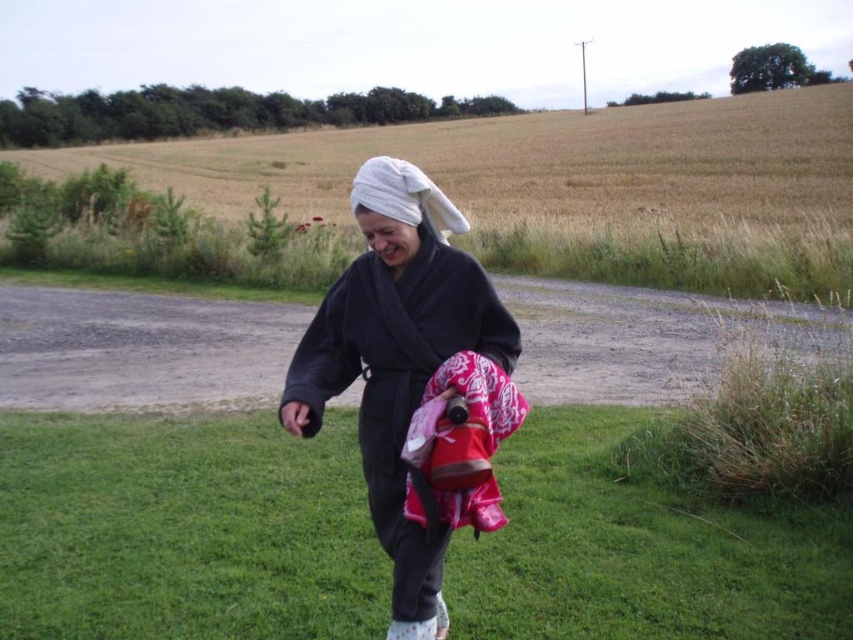
Who is more distant from viewer, (223, 552) or (397, 157)?

Positioned behind is point (397, 157).

Does green grass at lower center lie behind white towel at center?

Yes, it is.

Identify the location of green grass at lower center. This screenshot has width=853, height=640. (184, 531).

Does green grass at lower center have a larger size compared to brown grassland at center?

No.

Who is lower down, green grass at lower center or brown grassland at center?

green grass at lower center

Describe the element at coordinates (184, 531) in the screenshot. I see `green grass at lower center` at that location.

Locate an element on the screen. green grass at lower center is located at coordinates (184, 531).

Which of these two, brown grassland at center or dark gray bathrobe at center, stands shorter?

Standing shorter between the two is dark gray bathrobe at center.

Who is positioned more to the right, brown grassland at center or dark gray bathrobe at center?

From the viewer's perspective, brown grassland at center appears more on the right side.

Is point (193, 202) closer to camera compared to point (421, 532)?

That is False.

Locate an element on the screen. This screenshot has height=640, width=853. brown grassland at center is located at coordinates (573, 186).